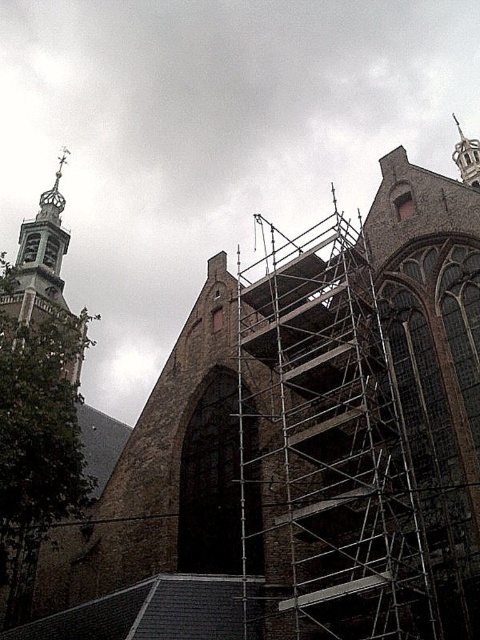
You are a construction worker standing at the silver metallic scaffolding at center. You need to reach the gold ornate tower at upper left for inspection. Given that your ladder can extend up to 70 meters, will it be sufficient to bridge the gap between the two structures?

The distance between the silver metallic scaffolding at center and the gold ornate tower at upper left is 72.27 meters. Since the ladder can only extend up to 70 meters, it will not be sufficient to bridge the gap between the two structures.

Consider the image. You are an architect inspecting the church renovation. You notice the silver metallic scaffolding at center and the gold ornate tower at upper left. Which structure is taller?

The gold ornate tower at upper left is taller than the silver metallic scaffolding at center.

You are an architect inspecting the church renovation. You notice the silver metallic scaffolding at center and the gold ornate tower at upper left. Which object is positioned higher in the image?

The gold ornate tower at upper left is positioned higher than the silver metallic scaffolding at center.